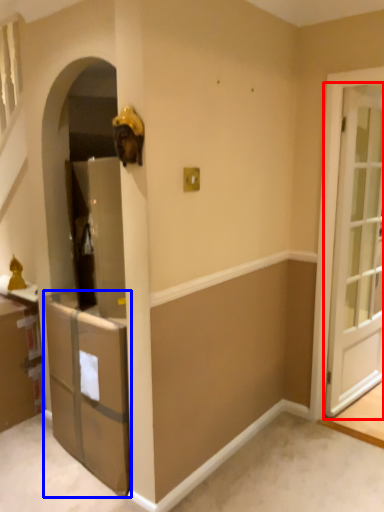
Question: Which object appears closest to the camera in this image, door (highlighted by a red box) or cabinetry (highlighted by a blue box)?

Choices:
 (A) door
 (B) cabinetry

Answer: (B)